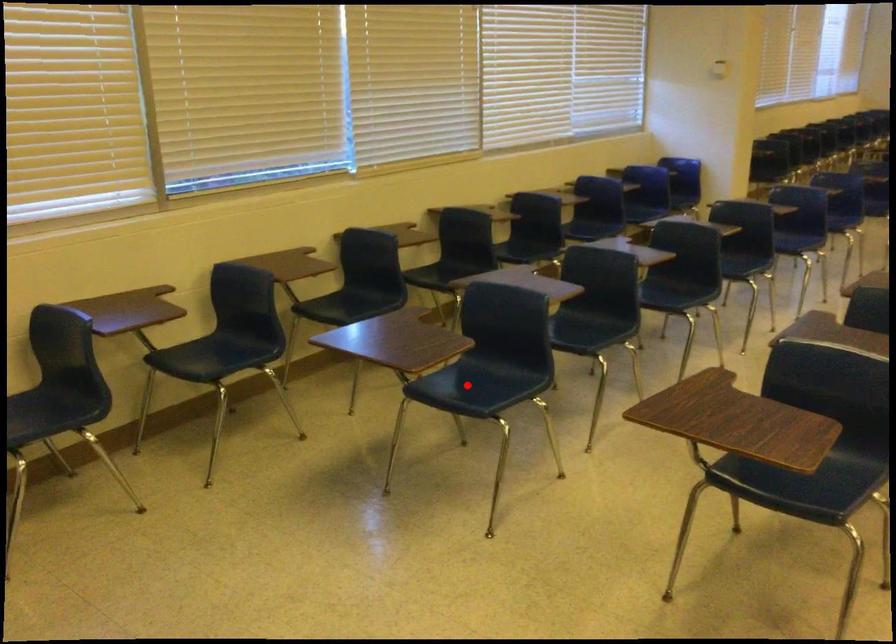
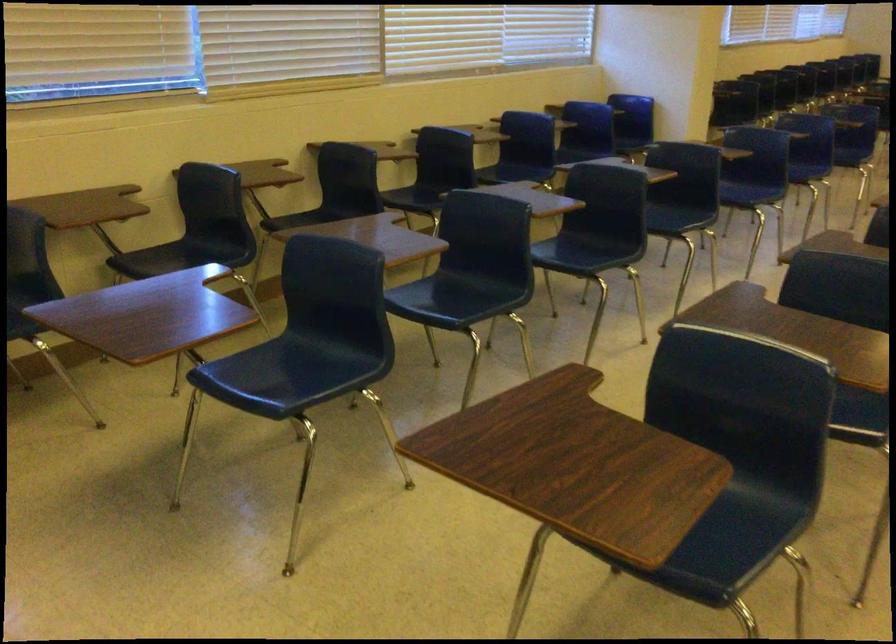
Question: I am providing you with two images of the same scene from different viewpoints. In image1, a red point is highlighted. Considering the same 3D point in image2, which of the following is correct?

Choices:
 (A) It is closer
 (B) It is farther

Answer: (A)